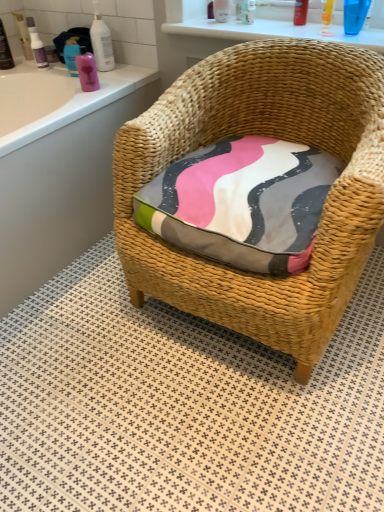
Locate an element on the screen. The height and width of the screenshot is (512, 384). free location in front of translucent plastic bottle at upper center, acting as the 7th toiletry starting from the left is located at coordinates (230, 26).